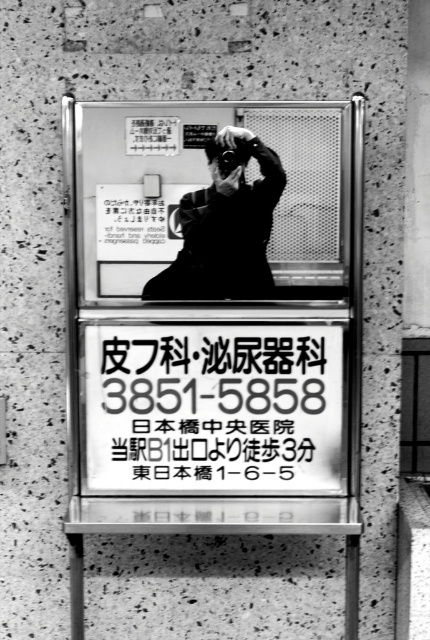
Question: Which of the following is the closest to the observer?

Choices:
 (A) (150, 433)
 (B) (252, 259)

Answer: (B)

Question: Is black paper sign at center to the left of matte black camera at center from the viewer's perspective?

Choices:
 (A) yes
 (B) no

Answer: (A)

Question: Can you confirm if black paper sign at center is positioned to the right of matte black camera at center?

Choices:
 (A) no
 (B) yes

Answer: (A)

Question: Can you confirm if black paper sign at center is positioned below matte black camera at center?

Choices:
 (A) yes
 (B) no

Answer: (A)